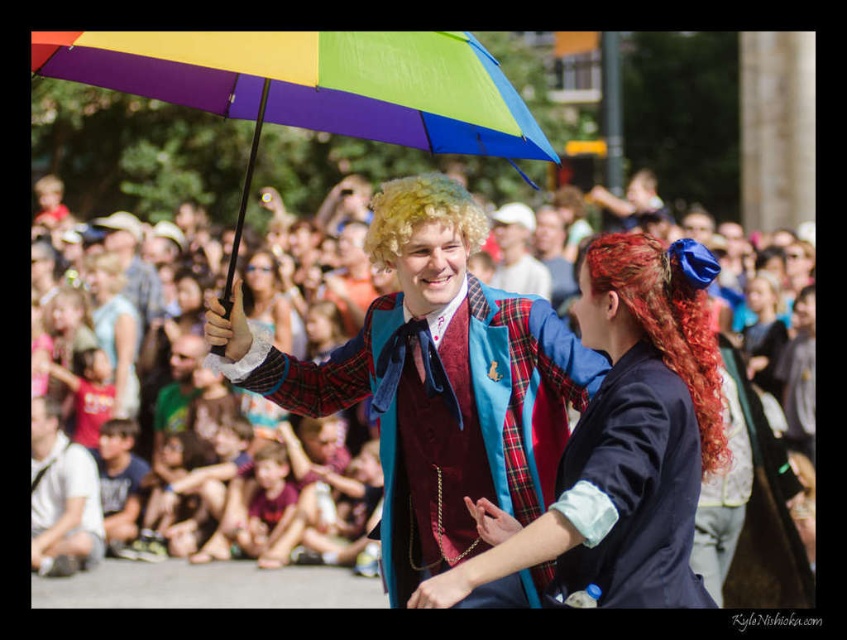
Question: Can you confirm if curly red hair at center is bigger than matte white shirt at lower left?

Choices:
 (A) yes
 (B) no

Answer: (A)

Question: Can you confirm if rainbow fabric umbrella at upper center is smaller than curly red hair at center?

Choices:
 (A) no
 (B) yes

Answer: (A)

Question: Which point appears closest to the camera in this image?

Choices:
 (A) (45, 560)
 (B) (713, 397)
 (C) (529, 257)
 (D) (109, 433)

Answer: (B)

Question: Considering the real-world distances, which object is farthest from the rainbow fabric umbrella at upper center?

Choices:
 (A) matte black shirt at lower left
 (B) matte white shirt at lower left

Answer: (B)

Question: In this image, where is matte multicolored umbrella at center located relative to matte white shirt at lower left?

Choices:
 (A) left
 (B) right

Answer: (B)

Question: Which of the following is the closest to the observer?

Choices:
 (A) rainbow fabric umbrella at upper center
 (B) matte multicolored umbrella at center
 (C) plaid fabric jacket at center

Answer: (A)